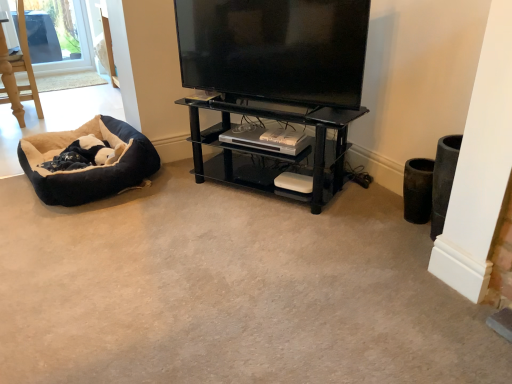
Locate an element on the screen. free space in front of black glass shelf at center is located at coordinates (251, 271).